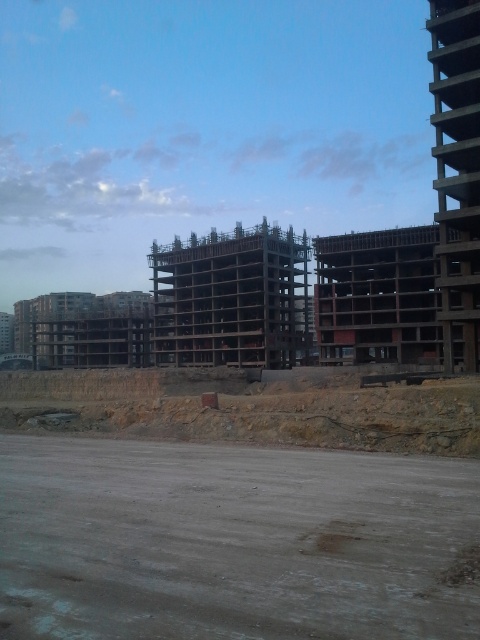
You are a construction worker standing at the point labeled point [408,586]. You need to move towards the point labeled point [172,308]. Will you be moving towards the background of the image?

Yes, because point [408,586] is in front of point [172,308], so moving from the former to the latter would mean moving towards the background of the image.

You are a construction worker who needs to determine the material thickness for the foundation. The dirt at center and dark wood building at center are both part of the site. Which material has a greater thickness?

The dark wood building at center has a greater thickness than the dirt at center.